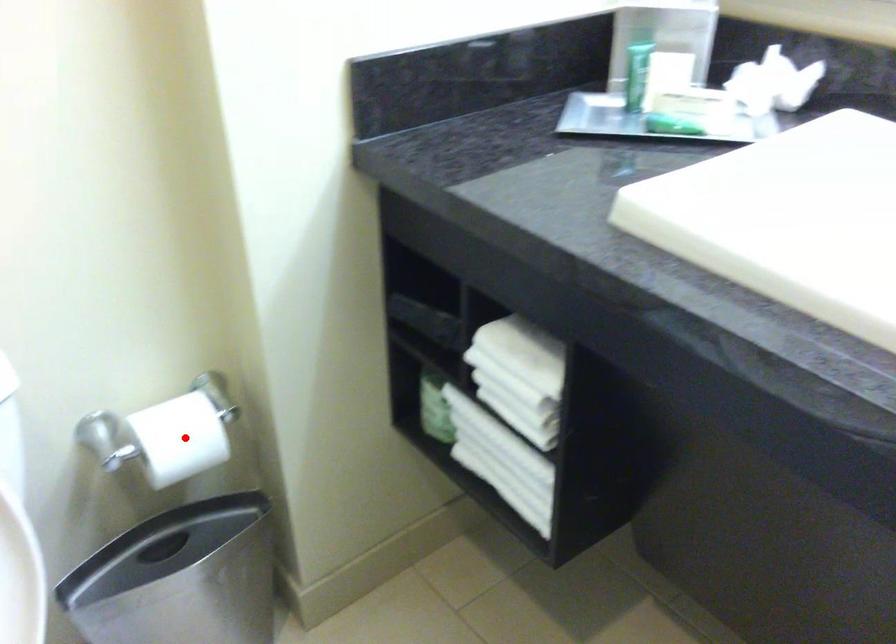
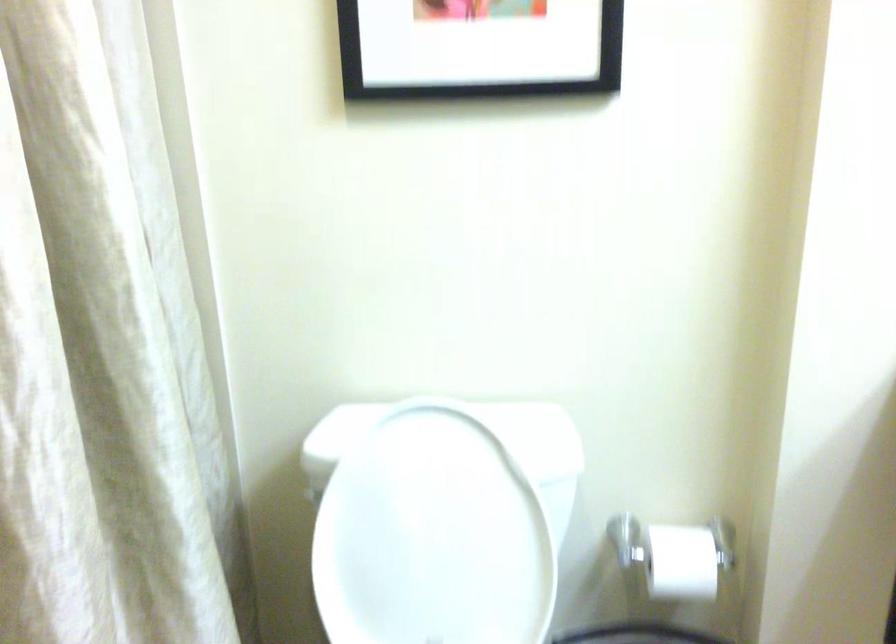
Question: I am providing you with two images of the same scene from different viewpoints. In image1, a red point is highlighted. Considering the same 3D point in image2, which of the following is correct?

Choices:
 (A) It is closer
 (B) It is farther

Answer: (B)